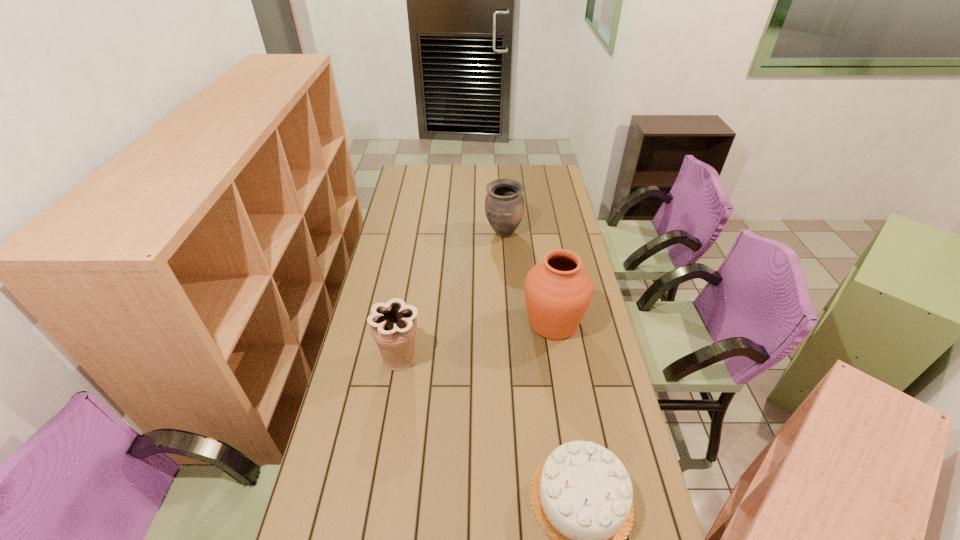
Identify the location of the tallest urn. The height and width of the screenshot is (540, 960). (558, 290).

Find the location of a particular element. the farthest urn is located at coordinates (504, 204).

This screenshot has height=540, width=960. I want to click on the shortest urn, so click(393, 324).

At what (x,y) coordinates should I click in order to perform the action: click on the third tallest object. Please return your answer as a coordinate pair (x, y). The width and height of the screenshot is (960, 540). Looking at the image, I should click on click(393, 324).

Identify the location of vacant space situated on the front of the tallest urn. The width and height of the screenshot is (960, 540). (566, 402).

You are a GUI agent. You are given a task and a screenshot of the screen. Output one action in this format:
    pyautogui.click(x=<x>, y=<y>)
    Task: Click on the vacant position located 0.240m on the front of the farthest object
    This screenshot has width=960, height=540.
    Given the screenshot: What is the action you would take?
    pyautogui.click(x=507, y=281)

Find the location of a particular element. This screenshot has width=960, height=540. free point located 0.110m on the right of the shortest urn is located at coordinates (455, 358).

You are a GUI agent. You are given a task and a screenshot of the screen. Output one action in this format:
    pyautogui.click(x=<x>, y=<y>)
    Task: Click on the object that is at the left edge
    
    Given the screenshot: What is the action you would take?
    pyautogui.click(x=393, y=324)

Image resolution: width=960 pixels, height=540 pixels. Find the location of `object that is positioned at the right edge`. object that is positioned at the right edge is located at coordinates (558, 290).

In the image, there is a desktop. Where is `free region at the far edge`? The width and height of the screenshot is (960, 540). free region at the far edge is located at coordinates (511, 170).